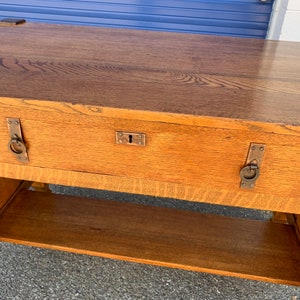
I want to click on blue wall, metal, so click(x=261, y=27).